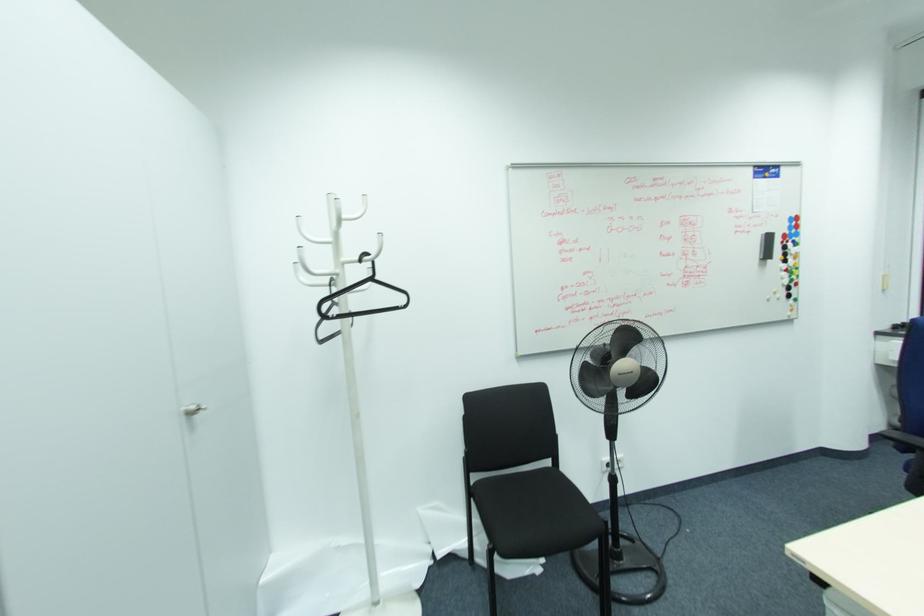
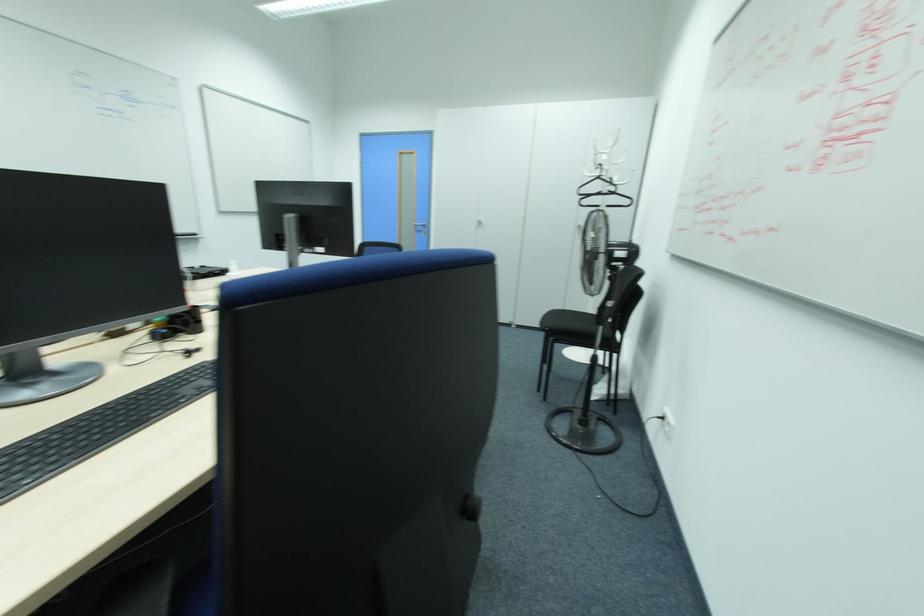
In the second image, find the point that corresponds to [371,280] in the first image.

(599, 177)